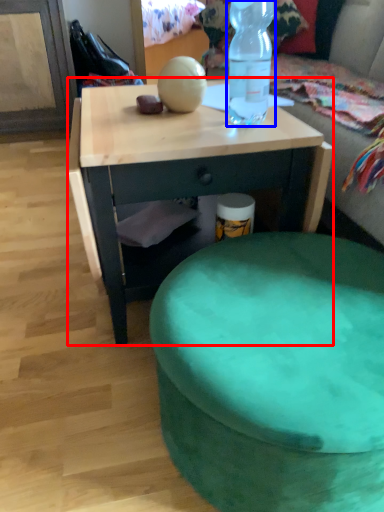
Question: Which point is closer to the camera, desk (highlighted by a red box) or bottle (highlighted by a blue box)?

Choices:
 (A) desk
 (B) bottle

Answer: (B)